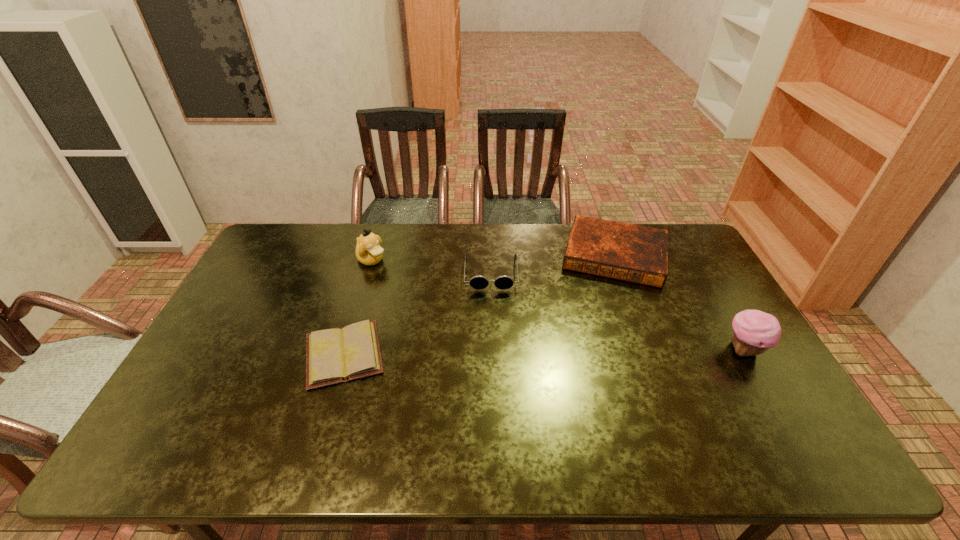
Where is `free space located 0.160m on the face of the duckling`? free space located 0.160m on the face of the duckling is located at coordinates (413, 288).

At what (x,y) coordinates should I click in order to perform the action: click on vacant point located on the face of the duckling. Please return your answer as a coordinate pair (x, y). Looking at the image, I should click on (415, 289).

Where is `vacant space located on the face of the duckling`? The image size is (960, 540). vacant space located on the face of the duckling is located at coordinates (422, 295).

The image size is (960, 540). What are the coordinates of `vacant point located 0.200m on the front-facing side of the third object from right to left` in the screenshot? It's located at (492, 339).

In order to click on vacant area located 0.170m on the front-facing side of the third object from right to left in this screenshot , I will do `click(492, 330)`.

Identify the location of vacant space situated on the front-facing side of the third object from right to left. This screenshot has width=960, height=540. (492, 347).

Locate an element on the screen. This screenshot has height=540, width=960. Bible located in the far edge section of the desktop is located at coordinates (639, 254).

Find the location of `duckling present at the far edge`. duckling present at the far edge is located at coordinates (368, 251).

The height and width of the screenshot is (540, 960). I want to click on sunglasses that is at the far edge, so click(x=478, y=282).

Find the location of a particular element. object that is at the near edge is located at coordinates (337, 355).